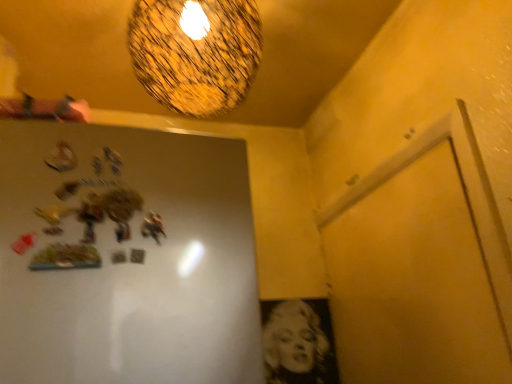
Measure the distance between point (191,113) and camera.

1.15 meters.

Describe the element at coordinates (195, 52) in the screenshot. This screenshot has height=384, width=512. I see `textured glass lampshade at upper center` at that location.

This screenshot has height=384, width=512. Identify the location of textured glass lampshade at upper center. (195, 52).

The height and width of the screenshot is (384, 512). I want to click on textured glass lampshade at upper center, so click(x=195, y=52).